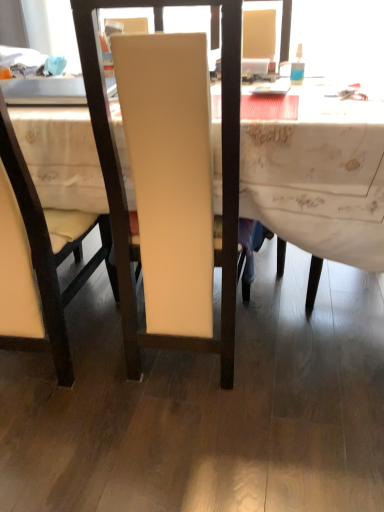
Question: From the image's perspective, would you say matte cream chair at center, the 1th chair in the left-to-right sequence, is positioned over white fabric desk at center?

Choices:
 (A) yes
 (B) no

Answer: (B)

Question: Does matte cream chair at center, which is the second chair from right to left, contain white fabric desk at center?

Choices:
 (A) no
 (B) yes

Answer: (A)

Question: Is matte cream chair at center, the 1th chair in the left-to-right sequence, taller than white fabric desk at center?

Choices:
 (A) no
 (B) yes

Answer: (B)

Question: Does matte cream chair at center, which is the second chair from right to left, turn towards white fabric desk at center?

Choices:
 (A) yes
 (B) no

Answer: (A)

Question: From a real-world perspective, is matte cream chair at center, which is the second chair from right to left, below white fabric desk at center?

Choices:
 (A) no
 (B) yes

Answer: (A)

Question: From the image's perspective, is matte white chair at center, arranged as the 2th chair when viewed from the left, positioned above or below translucent plastic bottle at upper right?

Choices:
 (A) below
 (B) above

Answer: (A)

Question: Is matte white chair at center, arranged as the 2th chair when viewed from the left, wider or thinner than translucent plastic bottle at upper right?

Choices:
 (A) wide
 (B) thin

Answer: (A)

Question: From a real-world perspective, relative to translucent plastic bottle at upper right, is matte white chair at center, arranged as the 2th chair when viewed from the left, vertically above or below?

Choices:
 (A) below
 (B) above

Answer: (A)

Question: Considering the positions of matte white chair at center, marked as the 1th chair in a right-to-left arrangement, and translucent plastic bottle at upper right in the image, is matte white chair at center, marked as the 1th chair in a right-to-left arrangement, taller or shorter than translucent plastic bottle at upper right?

Choices:
 (A) short
 (B) tall

Answer: (B)

Question: Considering the positions of matte white chair at center, arranged as the 2th chair when viewed from the left, and white fabric desk at center in the image, is matte white chair at center, arranged as the 2th chair when viewed from the left, wider or thinner than white fabric desk at center?

Choices:
 (A) wide
 (B) thin

Answer: (B)

Question: Relative to white fabric desk at center, is matte white chair at center, marked as the 1th chair in a right-to-left arrangement, in front or behind?

Choices:
 (A) front
 (B) behind

Answer: (A)

Question: Is point (228, 351) closer or farther from the camera than point (299, 199)?

Choices:
 (A) farther
 (B) closer

Answer: (A)

Question: From a real-world perspective, is matte white chair at center, marked as the 1th chair in a right-to-left arrangement, positioned above or below white fabric desk at center?

Choices:
 (A) below
 (B) above

Answer: (B)

Question: Does point click(89, 28) appear closer or farther from the camera than point click(44, 292)?

Choices:
 (A) farther
 (B) closer

Answer: (B)

Question: In terms of height, does matte white chair at center, arranged as the 2th chair when viewed from the left, look taller or shorter compared to matte cream chair at center, which is the second chair from right to left?

Choices:
 (A) short
 (B) tall

Answer: (B)